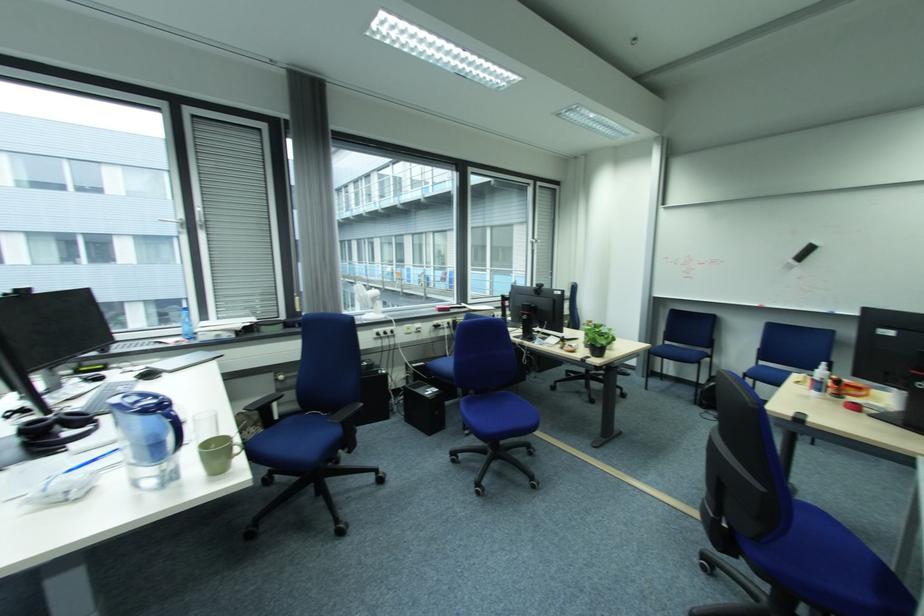
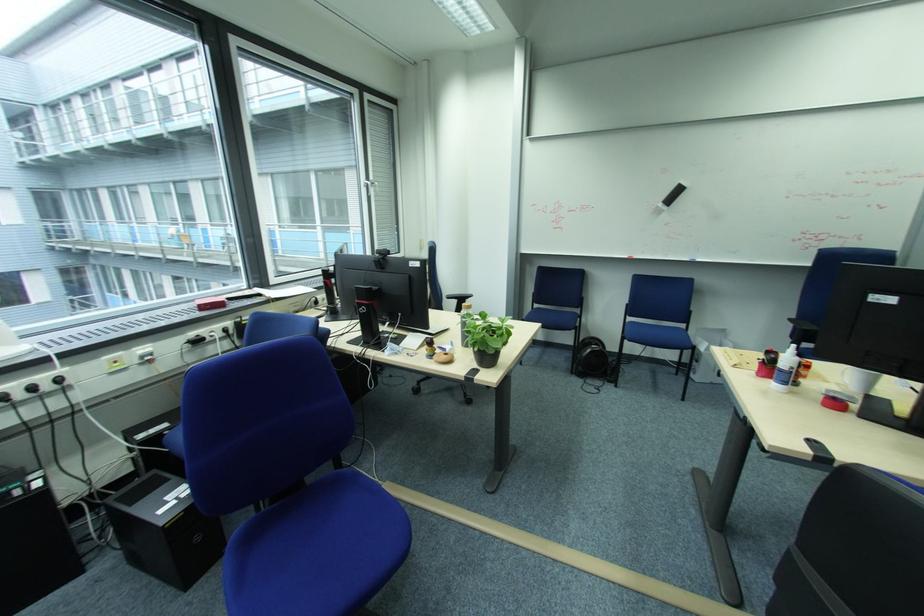
Where in the second image is the point corresponding to [801,262] from the first image?

(669, 206)